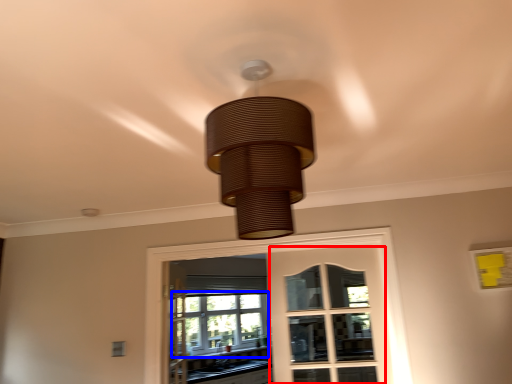
Question: Which point is further to the camera, screen door (highlighted by a red box) or bay window (highlighted by a blue box)?

Choices:
 (A) screen door
 (B) bay window

Answer: (B)